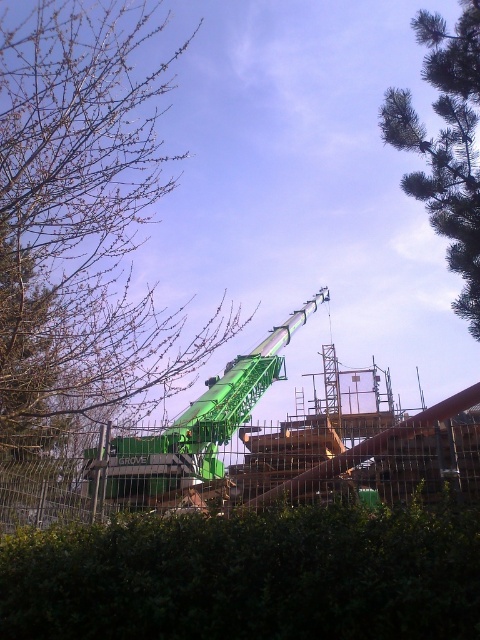
Question: Where is metal wire fence at lower center located in relation to green pine tree at upper right in the image?

Choices:
 (A) left
 (B) right

Answer: (A)

Question: Does bare branches at upper left appear on the right side of green matte crane at center?

Choices:
 (A) yes
 (B) no

Answer: (B)

Question: Which of the following is the closest to the observer?

Choices:
 (A) green leafy hedge at lower center
 (B) green pine tree at upper right

Answer: (A)

Question: Estimate the real-world distances between objects in this image. Which object is closer to the green pine tree at upper right?

Choices:
 (A) green matte crane at center
 (B) bare branches at upper left
 (C) metal wire fence at lower center
 (D) green leafy hedge at lower center

Answer: (D)

Question: Among these objects, which one is farthest from the camera?

Choices:
 (A) green pine tree at upper right
 (B) green matte crane at center

Answer: (A)

Question: Does bare branches at upper left appear over metal wire fence at lower center?

Choices:
 (A) no
 (B) yes

Answer: (B)